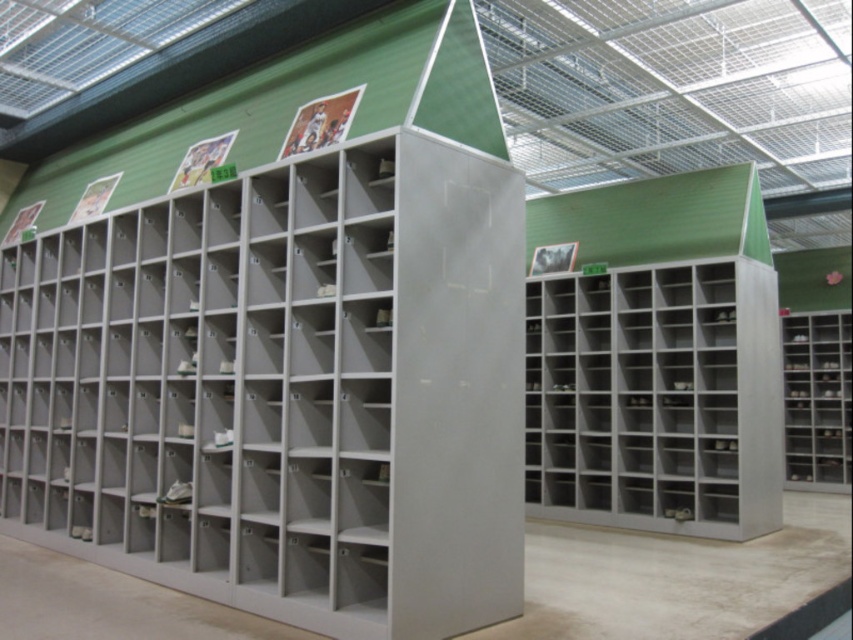
Who is shorter, matte gray bookshelf at center or metallic gray bookshelf at center?

metallic gray bookshelf at center is shorter.

Between point (393, 346) and point (544, 342), which one is positioned behind?

Point (544, 342)

Is point (141, 554) farther from viewer compared to point (750, 353)?

No, it is not.

Find the location of a particular element. This screenshot has height=640, width=853. matte gray bookshelf at center is located at coordinates (283, 388).

Is matte gray bookshelf at center below metallic gray bookshelf at right?

Incorrect, matte gray bookshelf at center is not positioned below metallic gray bookshelf at right.

Who is positioned more to the right, matte gray bookshelf at center or metallic gray bookshelf at right?

metallic gray bookshelf at right is more to the right.

In order to click on matte gray bookshelf at center in this screenshot , I will do `click(283, 388)`.

You are a GUI agent. You are given a task and a screenshot of the screen. Output one action in this format:
    pyautogui.click(x=<x>, y=<y>)
    Task: Click on the matte gray bookshelf at center
    Image resolution: width=853 pixels, height=640 pixels.
    Given the screenshot: What is the action you would take?
    pyautogui.click(x=283, y=388)

The image size is (853, 640). Identify the location of metallic gray bookshelf at center. (656, 397).

Is point (770, 499) farther from viewer compared to point (799, 376)?

No.

Measure the distance between point (741, 333) and camera.

6.69 meters

Locate an element on the screen. The height and width of the screenshot is (640, 853). metallic gray bookshelf at center is located at coordinates (656, 397).